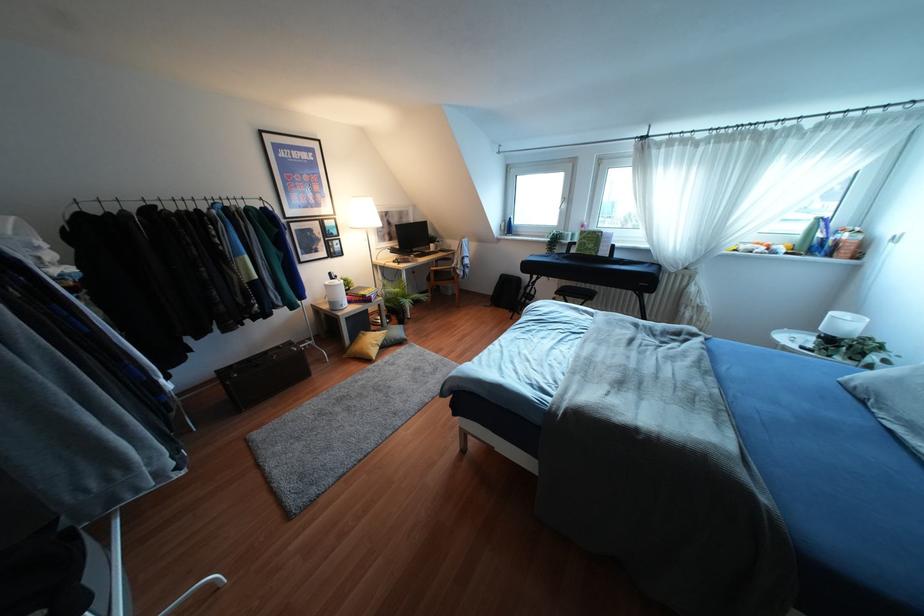
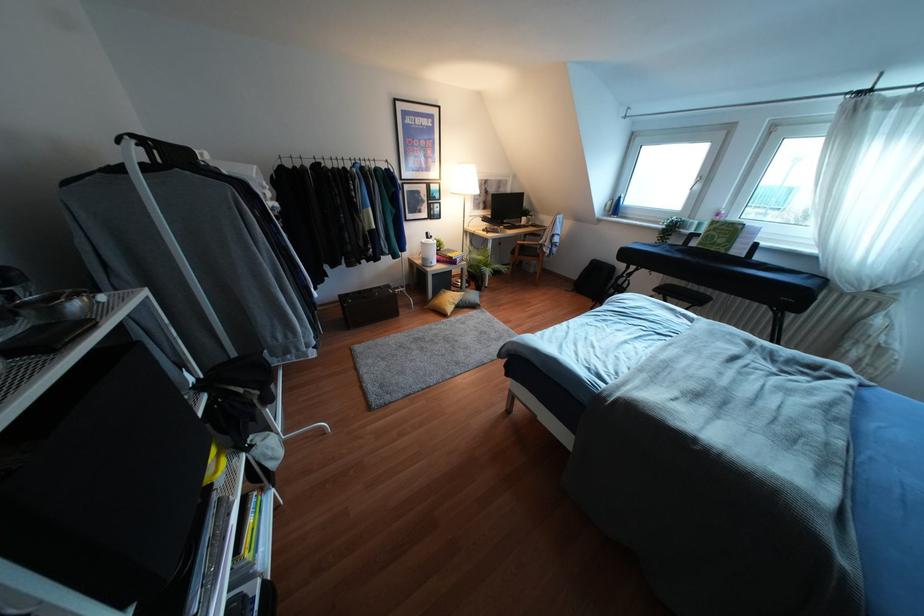
Locate, in the second image, the point that corresponds to point 330,273 in the first image.

(427, 233)